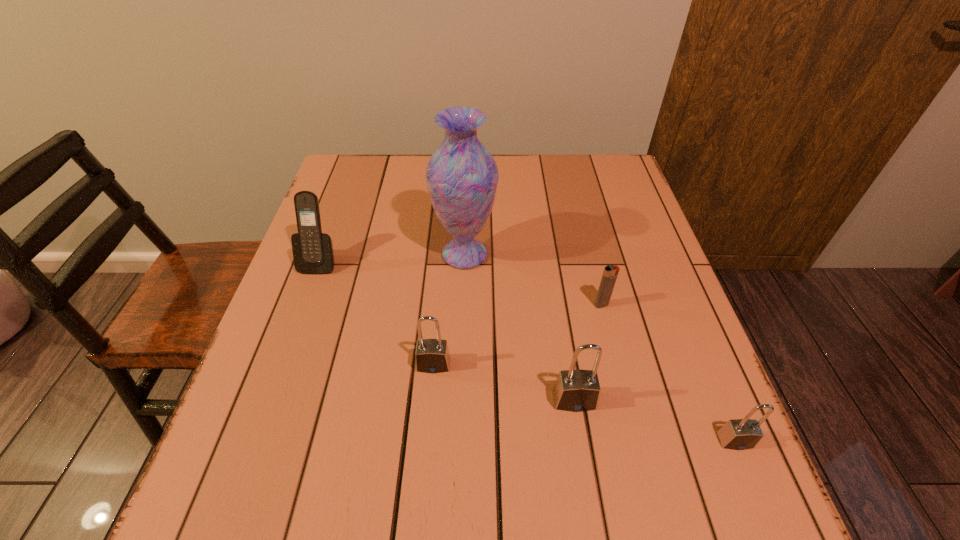
Find the location of a particular element. The height and width of the screenshot is (540, 960). vacant position located on the back of the vase is located at coordinates (468, 180).

Image resolution: width=960 pixels, height=540 pixels. I want to click on free location located on the left of the igniter, so click(x=447, y=305).

At what (x,y) coordinates should I click in order to perform the action: click on free space located on the front-facing side of the cellular telephone. Please return your answer as a coordinate pair (x, y). This screenshot has height=540, width=960. Looking at the image, I should click on (268, 406).

Locate an element on the screen. object at the left edge is located at coordinates (313, 253).

This screenshot has width=960, height=540. Identify the location of padlock present at the right edge. (739, 434).

In order to click on igniter that is positioned at the right edge in this screenshot , I will do `click(610, 273)`.

The image size is (960, 540). What are the coordinates of `object present at the near right corner` in the screenshot? It's located at (739, 434).

Where is `free space at the far edge of the desktop`? free space at the far edge of the desktop is located at coordinates (545, 177).

Locate an element on the screen. free space at the near edge of the desktop is located at coordinates (354, 432).

Find the location of `free space at the left edge of the desktop`. free space at the left edge of the desktop is located at coordinates (286, 293).